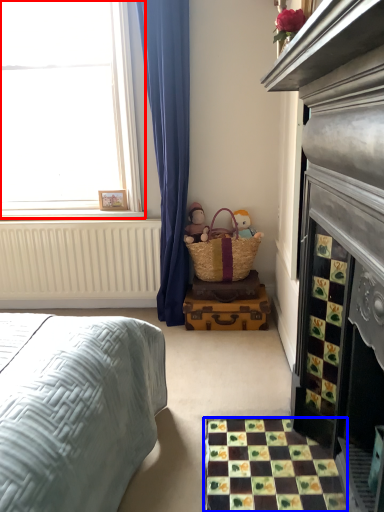
Question: Which point is closer to the camera, window (highlighted by a red box) or tile (highlighted by a blue box)?

Choices:
 (A) window
 (B) tile

Answer: (B)